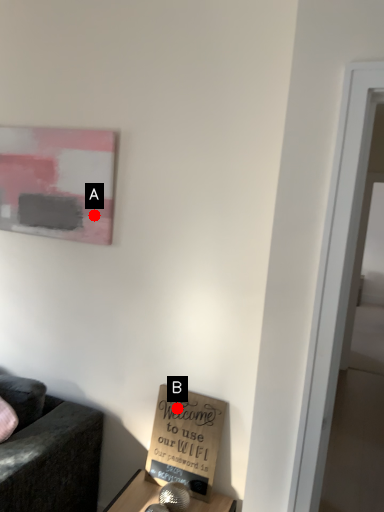
Question: Two points are circled on the image, labeled by A and B beside each circle. Which of the following is the farthest from the observer?

Choices:
 (A) A is further
 (B) B is further

Answer: (A)